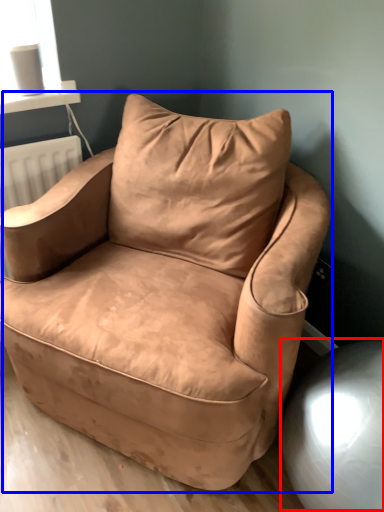
Question: Which object is further to the camera taking this photo, swivel chair (highlighted by a red box) or chair (highlighted by a blue box)?

Choices:
 (A) swivel chair
 (B) chair

Answer: (A)